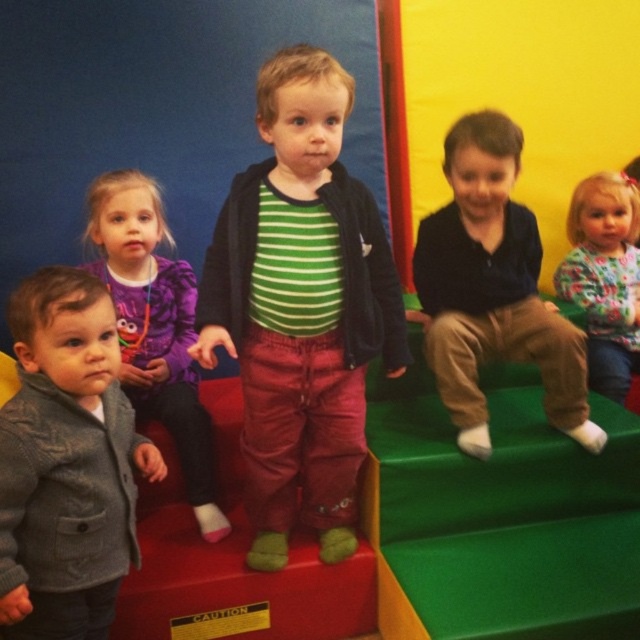
Who is positioned more to the left, green striped shirt at center or floral fabric dress at upper right?

From the viewer's perspective, green striped shirt at center appears more on the left side.

Who is higher up, green striped shirt at center or floral fabric dress at upper right?

Positioned higher is floral fabric dress at upper right.

Which is in front, point (330, 180) or point (595, 314)?

Point (330, 180) is more forward.

Where is `green striped shirt at center`? green striped shirt at center is located at coordinates (300, 307).

Which is in front, point (435, 260) or point (161, 368)?

Point (435, 260)

Which is in front, point (429, 344) or point (97, 188)?

Point (429, 344) is in front.

Identify the location of dark blue shirt at upper right. This screenshot has width=640, height=640. (493, 289).

Who is higher up, green striped shirt at center or knitted gray sweater at left?

green striped shirt at center is above.

Does green striped shirt at center lie in front of knitted gray sweater at left?

No, it is not.

Image resolution: width=640 pixels, height=640 pixels. What are the coordinates of `green striped shirt at center` in the screenshot? It's located at (300, 307).